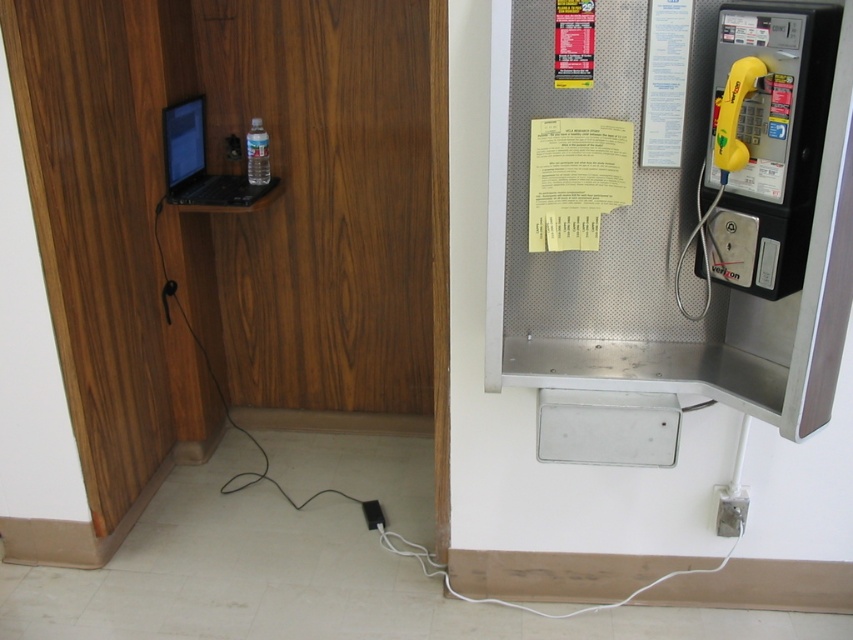
Is point (815, 44) closer to camera compared to point (196, 108)?

Yes, it is.

Is yellow plastic payphone at right thinner than matte black laptop at upper left?

Yes.

Between point (759, 144) and point (229, 186), which one is positioned in front?

Point (759, 144)

The image size is (853, 640). I want to click on yellow plastic payphone at right, so click(x=766, y=141).

Between yellow plastic payphone at right and black plastic plug at lower center, which one has less height?

Standing shorter between the two is black plastic plug at lower center.

Is point (798, 170) more distant than point (361, 502)?

That is False.

Who is more distant from viewer, (813, 108) or (363, 504)?

The point (363, 504) is behind.

Find the location of a particular element. The image size is (853, 640). yellow plastic payphone at right is located at coordinates (766, 141).

Measure the distance between matte black laptop at upper left and black plastic plug at lower center.

matte black laptop at upper left and black plastic plug at lower center are 1.25 meters apart from each other.

Between matte black laptop at upper left and black plastic plug at lower center, which one is positioned higher?

matte black laptop at upper left

Between point (183, 156) and point (364, 506), which one is positioned behind?

Positioned behind is point (364, 506).

This screenshot has height=640, width=853. I want to click on matte black laptop at upper left, so click(202, 163).